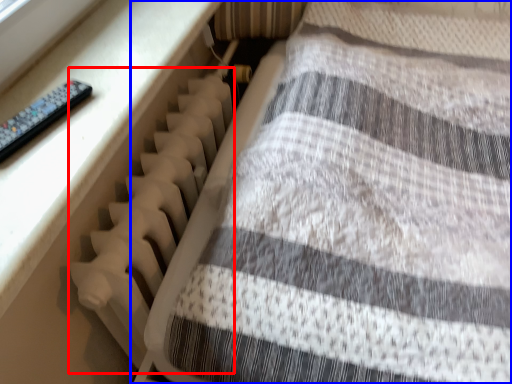
Question: Which of the following is the closest to the observer, radiator (highlighted by a red box) or furniture (highlighted by a blue box)?

Choices:
 (A) radiator
 (B) furniture

Answer: (B)